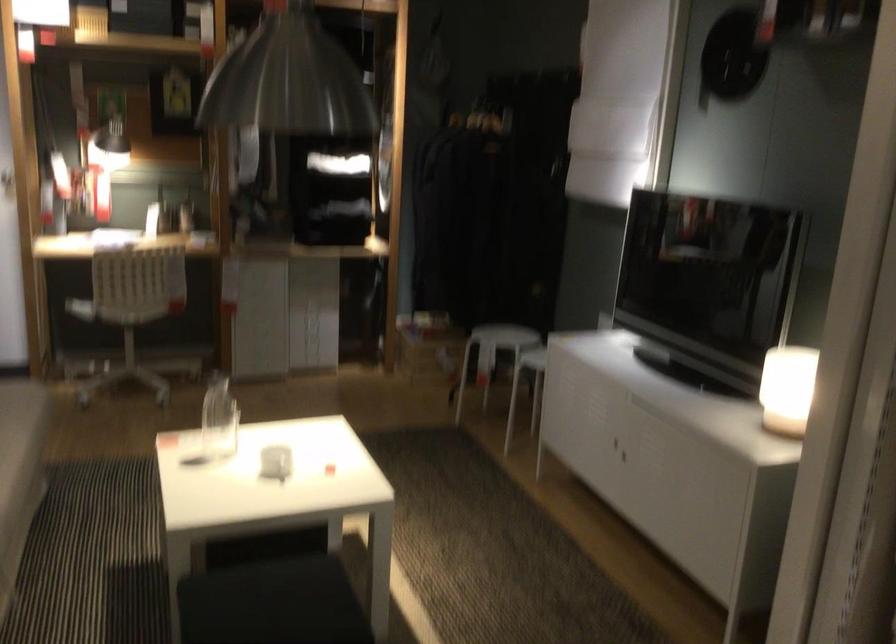
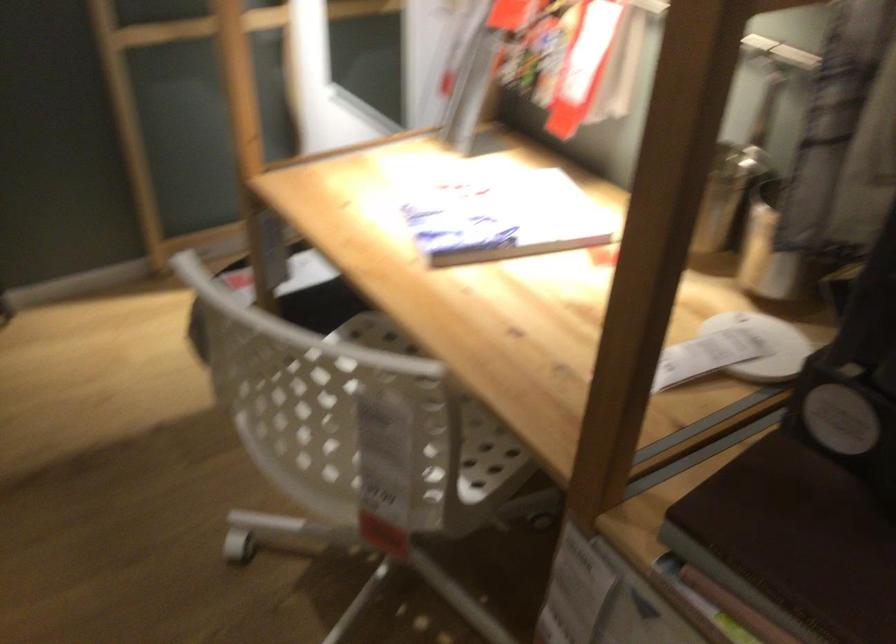
Question: I am providing you with two images of the same scene from different viewpoints. After the viewpoint changes to image2, which objects are now occluded?

Choices:
 (A) metal shaker cup
 (B) chair sitting surface
 (C) white chair sitting surface
 (D) white chair handle

Answer: (B)